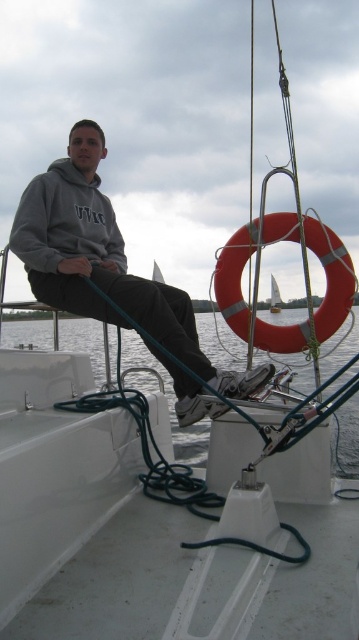
Measure the distance between white water at lower center and rubber ring at right.

4.59 meters

Is white water at lower center to the left of rubber ring at right from the viewer's perspective?

Incorrect, white water at lower center is not on the left side of rubber ring at right.

Is point (40, 340) positioned after point (285, 214)?

Yes, it is.

Find the location of a particular element. The height and width of the screenshot is (640, 359). white water at lower center is located at coordinates (169, 403).

Who is higher up, gray matte hoodie at center or rubber ring at right?

Positioned higher is gray matte hoodie at center.

Who is more forward, (86, 186) or (322, 227)?

Point (322, 227)

Does point (100, 320) lie behind point (282, 340)?

No, it is not.

Find the location of a particular element. The image size is (359, 640). gray matte hoodie at center is located at coordinates (104, 260).

Is gray matte hoodie at center bigger than white water at lower center?

Incorrect, gray matte hoodie at center is not larger than white water at lower center.

Between point (168, 346) and point (67, 339), which one is positioned in front?

Positioned in front is point (168, 346).

Find the location of a particular element. gray matte hoodie at center is located at coordinates (104, 260).